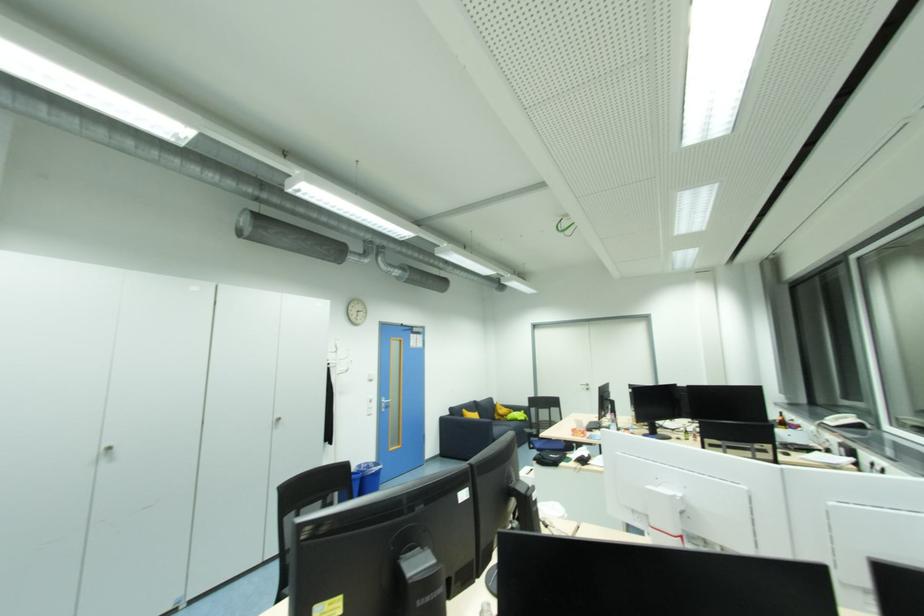
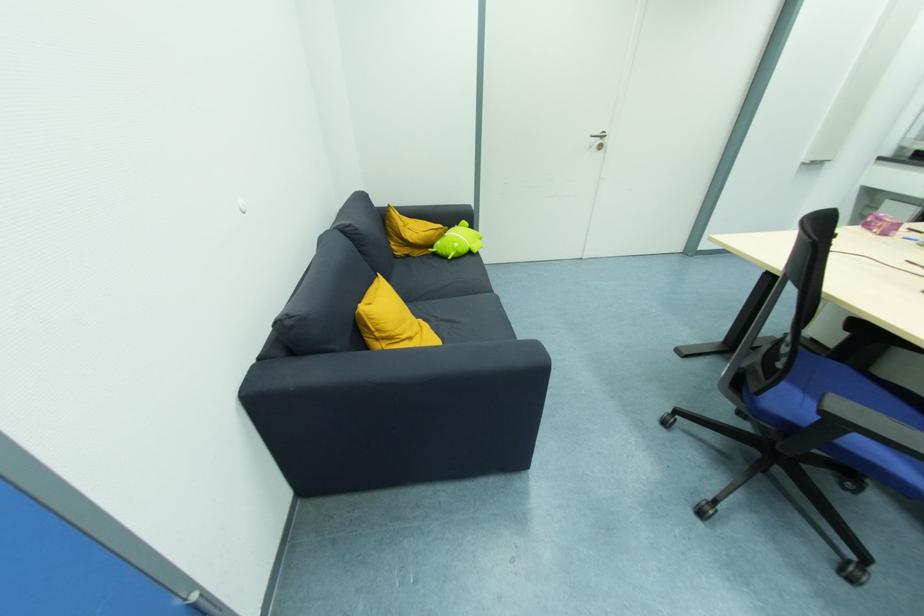
The point at (x=509, y=418) is marked in the first image. Where is the corresponding point in the second image?

(435, 248)